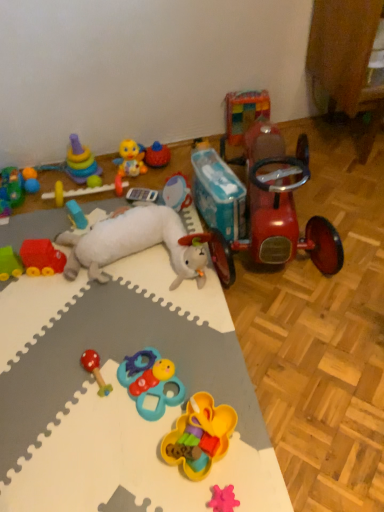
Where is `free space to the left of pink rubber bear at lower center, the 3th toy when ordered from right to left`? free space to the left of pink rubber bear at lower center, the 3th toy when ordered from right to left is located at coordinates (161, 480).